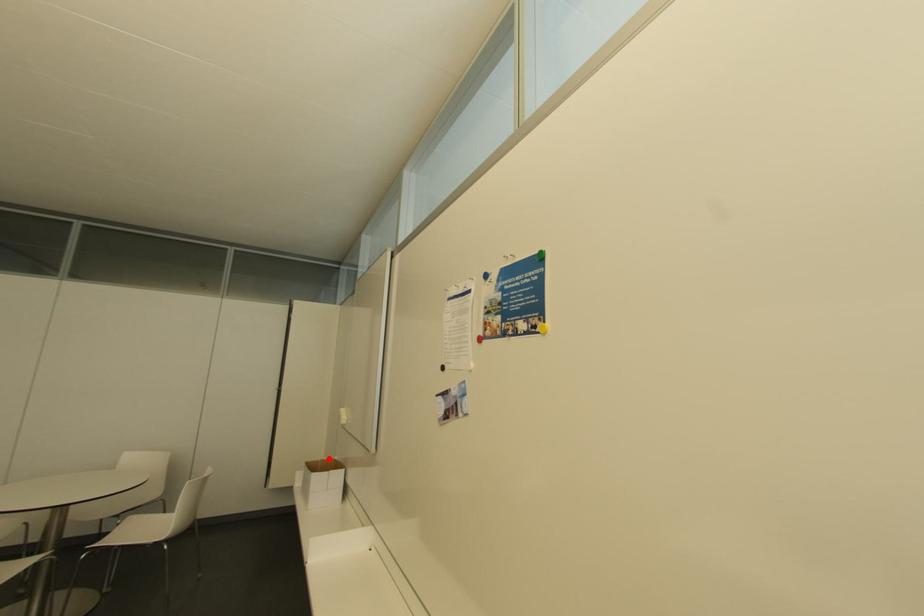
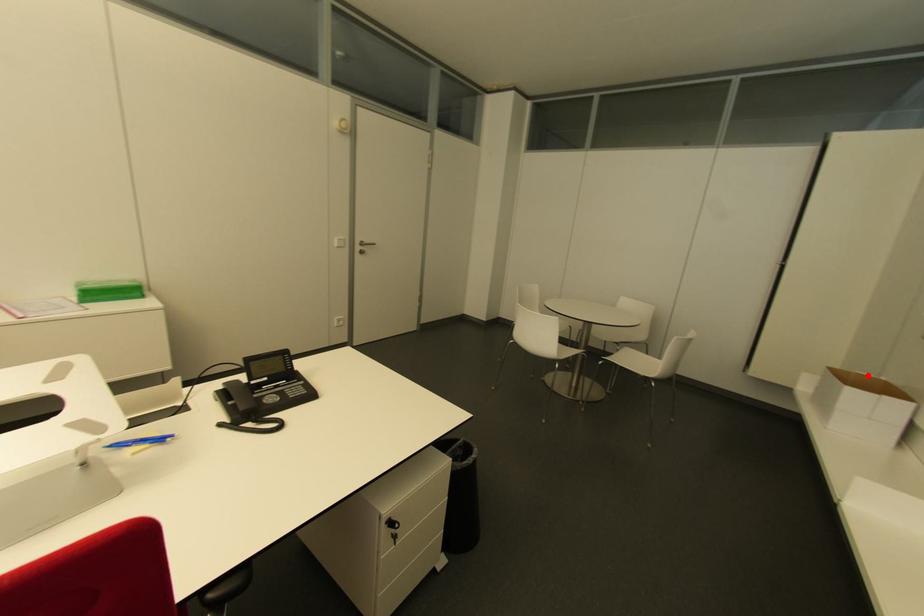
I am providing you with two images of the same scene from different viewpoints. A red point is marked on the first image and another point is marked on the second image. Is the marked point in image1 the same physical position as the marked point in image2?

Yes